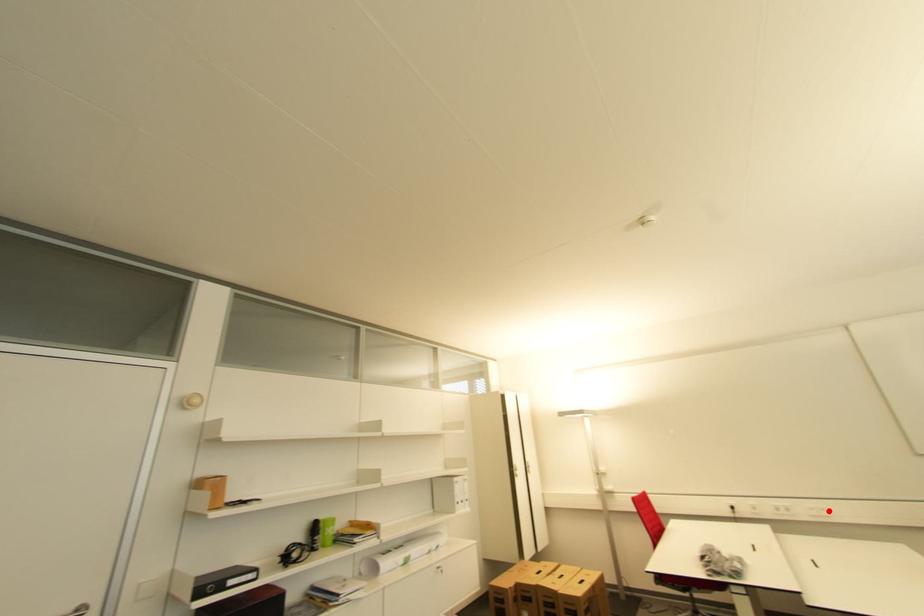
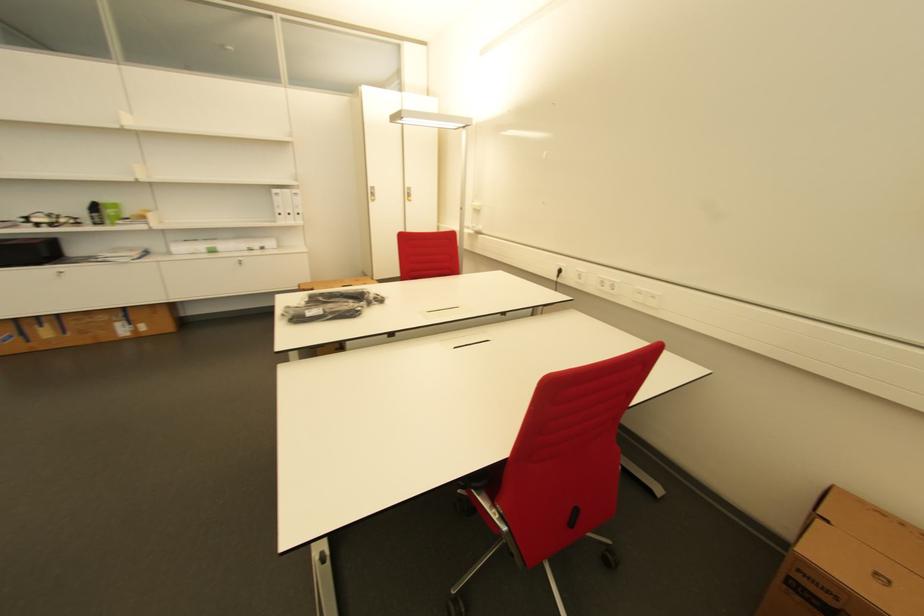
Question: I am providing you with two images of the same scene from different viewpoints. A red point is shown in image1. For the corresponding object point in image2, is it positioned nearer or farther from the camera?

Choices:
 (A) Nearer
 (B) Farther

Answer: (B)